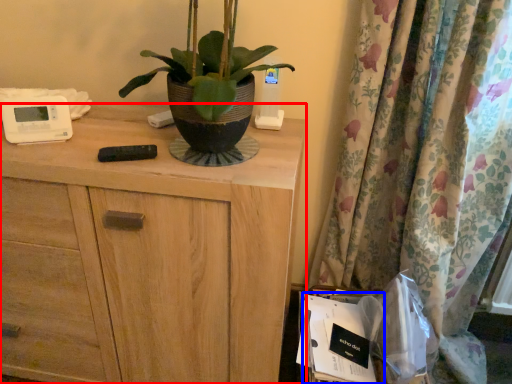
Question: Which object appears closest to the camera in this image, chest of drawers (highlighted by a red box) or paperback book (highlighted by a blue box)?

Choices:
 (A) chest of drawers
 (B) paperback book

Answer: (A)